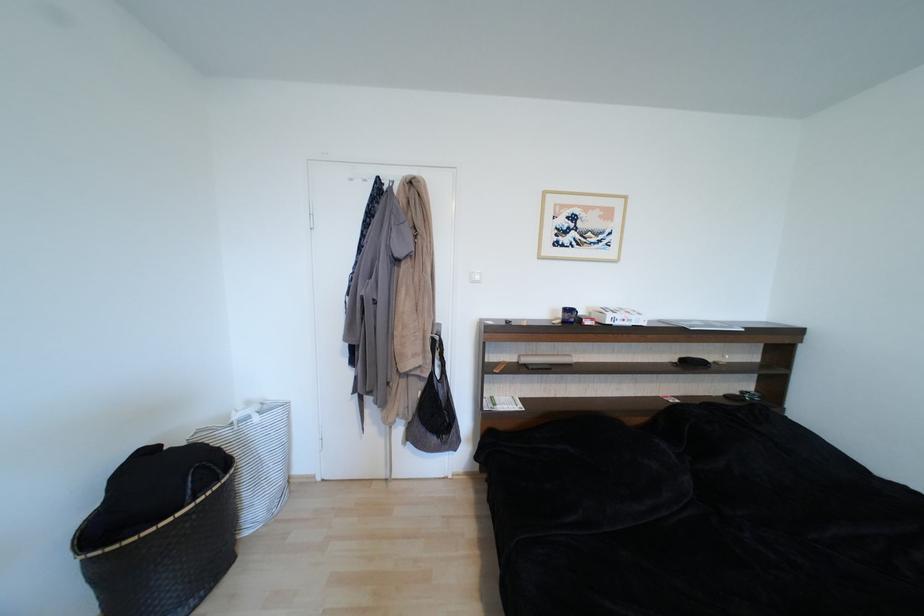
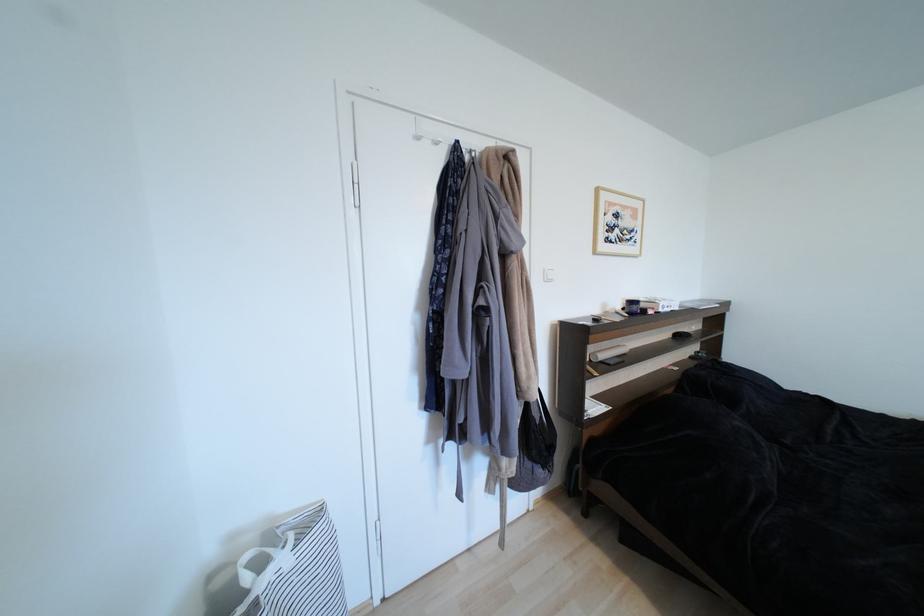
The point at (580, 219) is marked in the first image. Where is the corresponding point in the second image?

(623, 217)